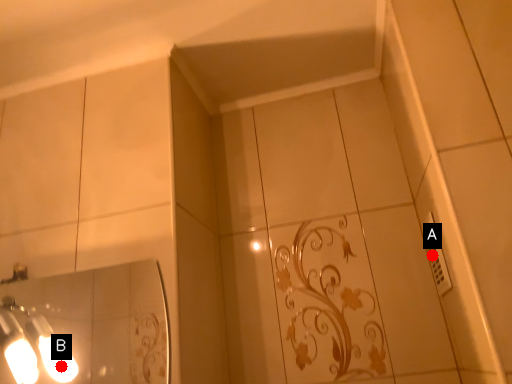
Question: Two points are circled on the image, labeled by A and B beside each circle. Which point is closer to the camera?

Choices:
 (A) A is closer
 (B) B is closer

Answer: (B)